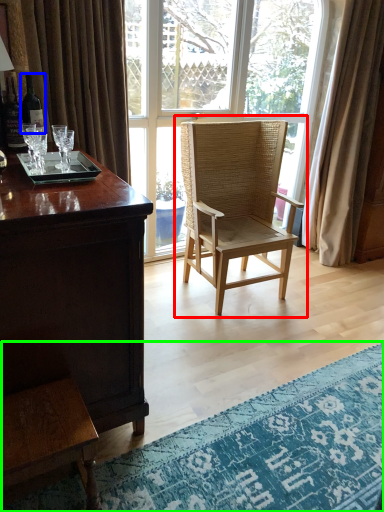
Question: Which object is positioned closest to chair (highlighted by a red box)? Select from bottle (highlighted by a blue box) and mat (highlighted by a green box).

Choices:
 (A) bottle
 (B) mat

Answer: (B)